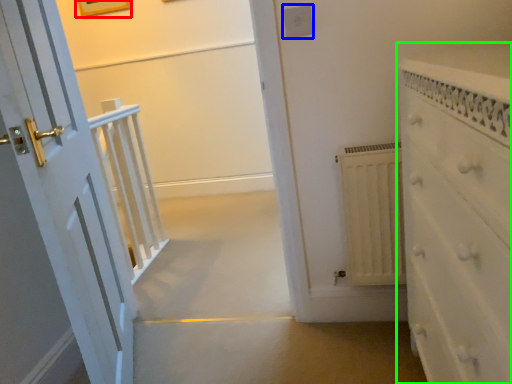
Question: Which is farther away from picture frame (highlighted by a red box)? electric outlet (highlighted by a blue box) or chest of drawers (highlighted by a green box)?

Choices:
 (A) electric outlet
 (B) chest of drawers

Answer: (B)